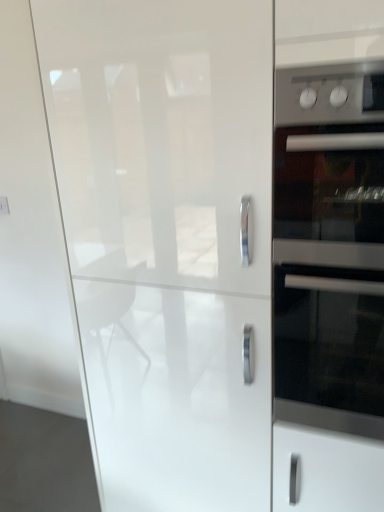
Measure the distance between stainless steel oven at right and camera.

stainless steel oven at right is 35.61 inches away from camera.

Find the location of a particular element. The height and width of the screenshot is (512, 384). glossy white cabinet at center is located at coordinates (168, 239).

Considering the points (251, 366) and (344, 389), which point is behind, point (251, 366) or point (344, 389)?

The point (251, 366) is behind.

Is glossy white cabinet at center positioned before stainless steel oven at right?

Yes, the depth of glossy white cabinet at center is less than that of stainless steel oven at right.

Looking at this image, from the image's perspective, is glossy white cabinet at center located above or below stainless steel oven at right?

glossy white cabinet at center is situated higher than stainless steel oven at right in the image.

Based on the photo, does glossy white cabinet at center have a larger size compared to satin silver oven at right?

Indeed, glossy white cabinet at center has a larger size compared to satin silver oven at right.

From the image's perspective, is glossy white cabinet at center above or below satin silver oven at right?

From the image's perspective, glossy white cabinet at center appears below satin silver oven at right.

Is glossy white cabinet at center oriented towards satin silver oven at right?

No, glossy white cabinet at center is not facing towards satin silver oven at right.

What's the angular difference between glossy white cabinet at center and satin silver oven at right's facing directions?

0.00066 degrees.

From a real-world perspective, is satin silver oven at right physically below stainless steel oven at right?

No, from a real-world perspective, satin silver oven at right is not under stainless steel oven at right.

From their relative heights in the image, would you say satin silver oven at right is taller or shorter than stainless steel oven at right?

In the image, satin silver oven at right appears to be shorter than stainless steel oven at right.

In the scene shown: Are satin silver oven at right and stainless steel oven at right far apart?

No, satin silver oven at right is not far from stainless steel oven at right.

From the picture: Which is behind, satin silver oven at right or stainless steel oven at right?

stainless steel oven at right is further away from the camera.

From the image's perspective, does satin silver oven at right appear higher than glossy white cabinet at center?

Yes, from the image's perspective, satin silver oven at right is over glossy white cabinet at center.

Based on the photo, between satin silver oven at right and glossy white cabinet at center, which one appears on the right side from the viewer's perspective?

satin silver oven at right is more to the right.

This screenshot has height=512, width=384. In order to click on home appliance that appears above the glossy white cabinet at center (from a real-world perspective) in this screenshot , I will do `click(329, 247)`.

From the image's perspective, relative to satin silver oven at right, is stainless steel oven at right above or below?

stainless steel oven at right is below satin silver oven at right.

Visually, is stainless steel oven at right positioned to the left or to the right of satin silver oven at right?

Clearly, stainless steel oven at right is on the right of satin silver oven at right in the image.

From a real-world perspective, is stainless steel oven at right physically above satin silver oven at right?

No, from a real-world perspective, stainless steel oven at right is not on top of satin silver oven at right.

Is stainless steel oven at right inside the boundaries of glossy white cabinet at center, or outside?

stainless steel oven at right exists outside the volume of glossy white cabinet at center.

Which of these two, stainless steel oven at right or glossy white cabinet at center, is bigger?

glossy white cabinet at center.

Does stainless steel oven at right have a greater width compared to glossy white cabinet at center?

In fact, stainless steel oven at right might be narrower than glossy white cabinet at center.

Identify the location of oven behind the glossy white cabinet at center. (329, 349).

The width and height of the screenshot is (384, 512). What are the coordinates of `glass door on the left side of stainless steel oven at right` in the screenshot? It's located at (168, 239).

Locate an element on the screen. The width and height of the screenshot is (384, 512). home appliance above the glossy white cabinet at center (from the image's perspective) is located at coordinates (329, 247).

When comparing their distances from glossy white cabinet at center, does stainless steel oven at right or satin silver oven at right seem closer?

satin silver oven at right lies closer to glossy white cabinet at center than the other object.

Consider the image. Looking at the image, which one is located further to stainless steel oven at right, satin silver oven at right or glossy white cabinet at center?

glossy white cabinet at center is further to stainless steel oven at right.

Based on their spatial positions, is glossy white cabinet at center or stainless steel oven at right further from satin silver oven at right?

Based on the image, glossy white cabinet at center appears to be further to satin silver oven at right.

Which object lies further to the anchor point stainless steel oven at right, glossy white cabinet at center or satin silver oven at right?

Based on the image, glossy white cabinet at center appears to be further to stainless steel oven at right.

Considering their positions, is satin silver oven at right positioned closer to glossy white cabinet at center than stainless steel oven at right?

satin silver oven at right.

Which object lies further to the anchor point satin silver oven at right, stainless steel oven at right or glossy white cabinet at center?

glossy white cabinet at center is positioned further to the anchor satin silver oven at right.

Find the location of a particular element. glass door between satin silver oven at right and stainless steel oven at right from top to bottom is located at coordinates (168, 239).